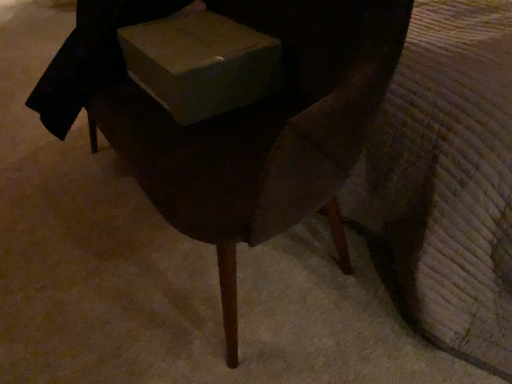
In order to face wooden chair at center, should I rotate leftwards or rightwards?

Turn left by 9.412 degrees to look at wooden chair at center.

Image resolution: width=512 pixels, height=384 pixels. I want to click on wooden chair at center, so pyautogui.click(x=238, y=120).

Describe the element at coordinates (238, 120) in the screenshot. The image size is (512, 384). I see `wooden chair at center` at that location.

The height and width of the screenshot is (384, 512). What do you see at coordinates (201, 64) in the screenshot?
I see `matte cardboard box at center` at bounding box center [201, 64].

This screenshot has height=384, width=512. Find the location of `matte cardboard box at center`. matte cardboard box at center is located at coordinates (201, 64).

Locate an element on the screen. This screenshot has width=512, height=384. wooden chair at center is located at coordinates (238, 120).

Which is more to the right, matte cardboard box at center or wooden chair at center?

matte cardboard box at center.

In the image, is matte cardboard box at center positioned in front of or behind wooden chair at center?

Clearly, matte cardboard box at center is behind wooden chair at center.

Which point is more distant from viewer, (x=202, y=43) or (x=111, y=66)?

The point (x=111, y=66) is farther from the camera.

From the image's perspective, between matte cardboard box at center and wooden chair at center, which one is located above?

matte cardboard box at center.

In the scene shown: From a real-world perspective, which object stands above the other?

matte cardboard box at center, from a real-world perspective.

Considering the sizes of objects matte cardboard box at center and wooden chair at center in the image provided, who is wider, matte cardboard box at center or wooden chair at center?

wooden chair at center.

Between matte cardboard box at center and wooden chair at center, which one has more height?

wooden chair at center is taller.

Who is smaller, matte cardboard box at center or wooden chair at center?

With smaller size is matte cardboard box at center.

Can we say matte cardboard box at center lies outside wooden chair at center?

No, matte cardboard box at center is not outside of wooden chair at center.

Is matte cardboard box at center in contact with wooden chair at center?

No, matte cardboard box at center is not next to wooden chair at center.

Is matte cardboard box at center facing towards wooden chair at center?

Yes.

Find the location of `box positioned vertically above the wooden chair at center (from a real-world perspective)`. box positioned vertically above the wooden chair at center (from a real-world perspective) is located at coordinates (201, 64).

Would you say wooden chair at center is to the left or to the right of matte cardboard box at center in the picture?

In the image, wooden chair at center appears on the left side of matte cardboard box at center.

Considering the positions of objects wooden chair at center and matte cardboard box at center in the image provided, who is behind, wooden chair at center or matte cardboard box at center?

matte cardboard box at center is more distant.

Considering the positions of point (339, 13) and point (200, 45), is point (339, 13) closer or farther from the camera than point (200, 45)?

Point (339, 13).

From the image's perspective, which is below, wooden chair at center or matte cardboard box at center?

wooden chair at center is shown below in the image.

From a real-world perspective, is wooden chair at center physically located above or below matte cardboard box at center?

Clearly, from a real-world perspective, wooden chair at center is below matte cardboard box at center.

Is wooden chair at center wider than matte cardboard box at center?

Correct, the width of wooden chair at center exceeds that of matte cardboard box at center.

In terms of height, does wooden chair at center look taller or shorter compared to matte cardboard box at center?

wooden chair at center is taller than matte cardboard box at center.

Which of these two, wooden chair at center or matte cardboard box at center, is bigger?

With larger size is wooden chair at center.

Can matte cardboard box at center be found inside wooden chair at center?

Absolutely, matte cardboard box at center is inside wooden chair at center.

Would you consider wooden chair at center to be distant from matte cardboard box at center?

They are positioned close to each other.

Looking at this image, is wooden chair at center looking in the opposite direction of matte cardboard box at center?

Yes.

Can you tell me how much wooden chair at center and matte cardboard box at center differ in facing direction?

wooden chair at center and matte cardboard box at center are facing 0.000905 degrees away from each other.

What are the coordinates of `chair below the matte cardboard box at center (from the image's perspective)` in the screenshot? It's located at (238, 120).

Locate an element on the screen. The image size is (512, 384). box behind the wooden chair at center is located at coordinates (201, 64).

You are a GUI agent. You are given a task and a screenshot of the screen. Output one action in this format:
    pyautogui.click(x=<x>, y=<y>)
    Task: Click on the chair in front of the matte cardboard box at center
    
    Given the screenshot: What is the action you would take?
    pyautogui.click(x=238, y=120)